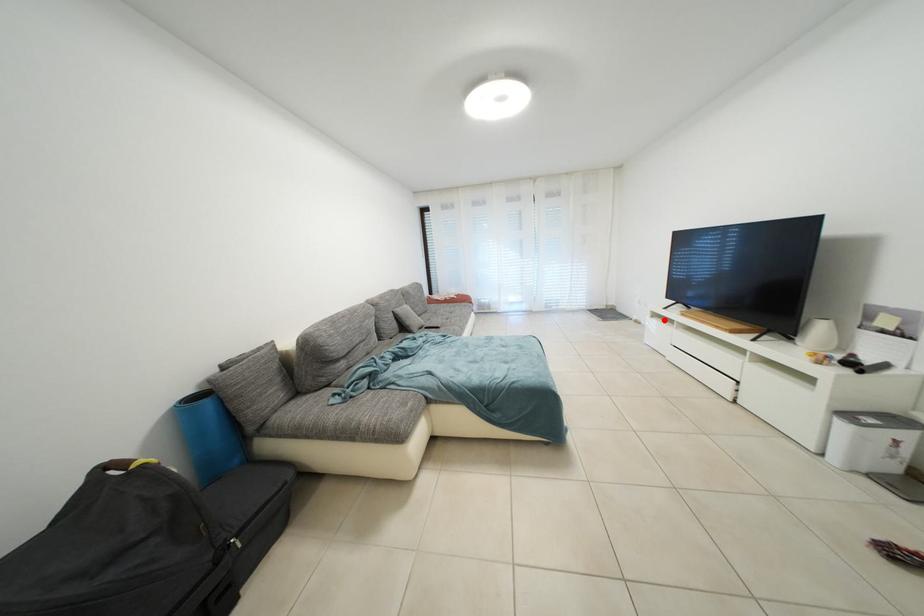
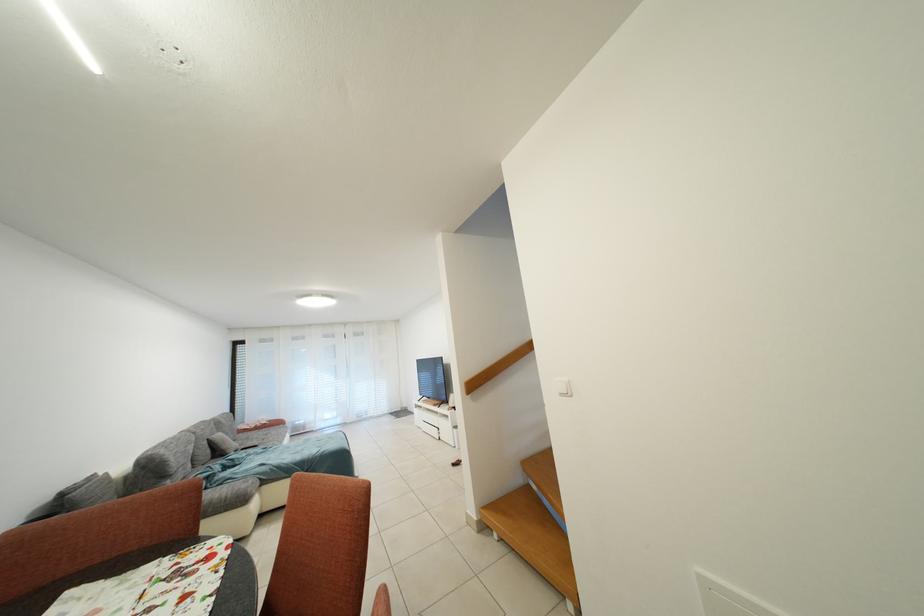
Question: I am providing you with two images of the same scene from different viewpoints. Image1 has a red point marked. In image2, the corresponding 3D location appears at what relative position? Reply with the corresponding letter.

Choices:
 (A) Closer
 (B) Farther

Answer: (B)